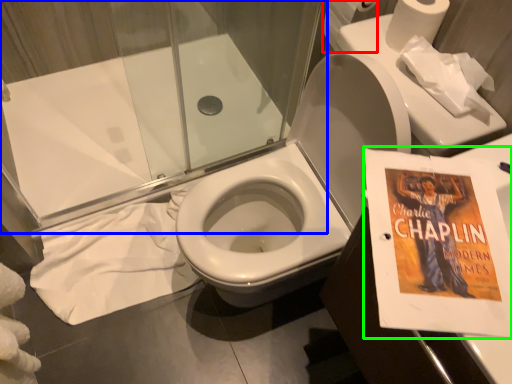
Question: Which object is the farthest from toilet paper (highlighted by a red box)? Choose among these: shower door (highlighted by a blue box) or paperback book (highlighted by a green box).

Choices:
 (A) shower door
 (B) paperback book

Answer: (A)